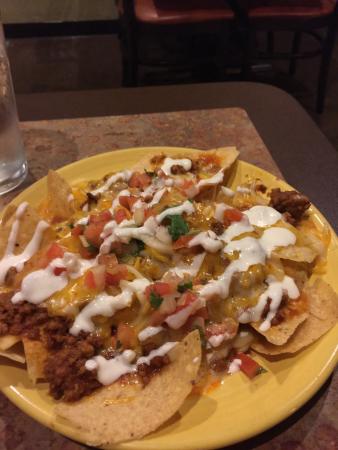
This screenshot has width=338, height=450. What are the coordinates of `plate` in the screenshot? It's located at (257, 422).